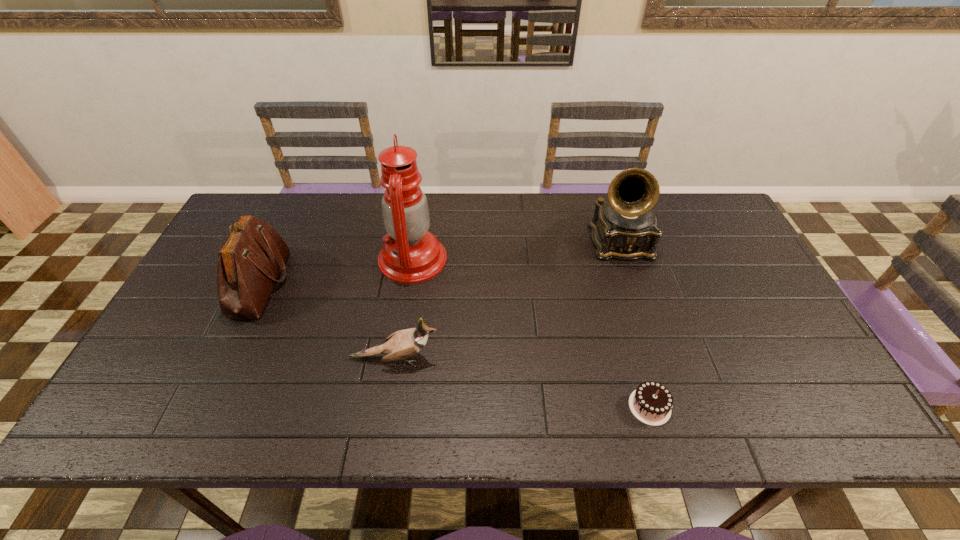
Choose which object is the fourth nearest neighbor to the shoulder bag. Please provide its 2D coordinates. Your answer should be formatted as a tuple, i.e. [(x, y)], where the tuple contains the x and y coordinates of a point satisfying the conditions above.

[(651, 403)]

The width and height of the screenshot is (960, 540). I want to click on object that ranks as the second closest to the phonograph record, so tap(410, 254).

This screenshot has width=960, height=540. In order to click on vacant space that satisfies the following two spatial constraints: 1. on the horn of the fourth shortest object; 2. at the face of the bird in this screenshot , I will do `click(657, 359)`.